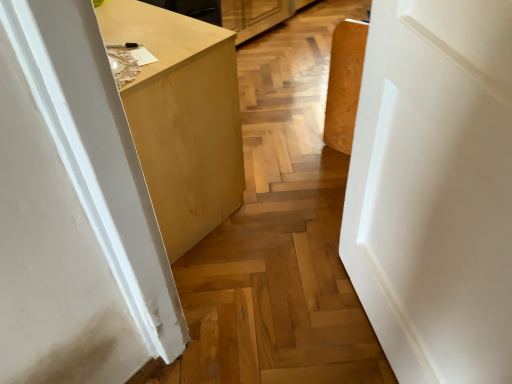
Question: From a real-world perspective, is white matte door at center positioned over matte wood cabinet at center based on gravity?

Choices:
 (A) no
 (B) yes

Answer: (B)

Question: Is white matte door at center bigger than matte wood cabinet at center?

Choices:
 (A) no
 (B) yes

Answer: (A)

Question: From a real-world perspective, does white matte door at center sit lower than matte wood cabinet at center?

Choices:
 (A) yes
 (B) no

Answer: (B)

Question: Considering the relative positions of white matte door at center and matte wood cabinet at center in the image provided, is white matte door at center to the right of matte wood cabinet at center from the viewer's perspective?

Choices:
 (A) yes
 (B) no

Answer: (A)

Question: Considering the relative sizes of white matte door at center and matte wood cabinet at center in the image provided, is white matte door at center smaller than matte wood cabinet at center?

Choices:
 (A) no
 (B) yes

Answer: (B)

Question: Is white matte door at center surrounding matte wood cabinet at center?

Choices:
 (A) yes
 (B) no

Answer: (B)

Question: From a real-world perspective, is matte wood cabinet at center over white matte door at center?

Choices:
 (A) no
 (B) yes

Answer: (A)

Question: Is matte wood cabinet at center far away from white matte door at center?

Choices:
 (A) yes
 (B) no

Answer: (B)

Question: Is matte wood cabinet at center oriented towards white matte door at center?

Choices:
 (A) yes
 (B) no

Answer: (B)

Question: Does matte wood cabinet at center have a greater height compared to white matte door at center?

Choices:
 (A) no
 (B) yes

Answer: (A)

Question: Considering the relative positions of matte wood cabinet at center and white matte door at center in the image provided, is matte wood cabinet at center to the left of white matte door at center from the viewer's perspective?

Choices:
 (A) no
 (B) yes

Answer: (B)

Question: Is matte wood cabinet at center completely or partially outside of white matte door at center?

Choices:
 (A) no
 (B) yes

Answer: (B)

Question: Considering the positions of matte wood cabinet at center and white matte door at center in the image, is matte wood cabinet at center bigger or smaller than white matte door at center?

Choices:
 (A) small
 (B) big

Answer: (B)